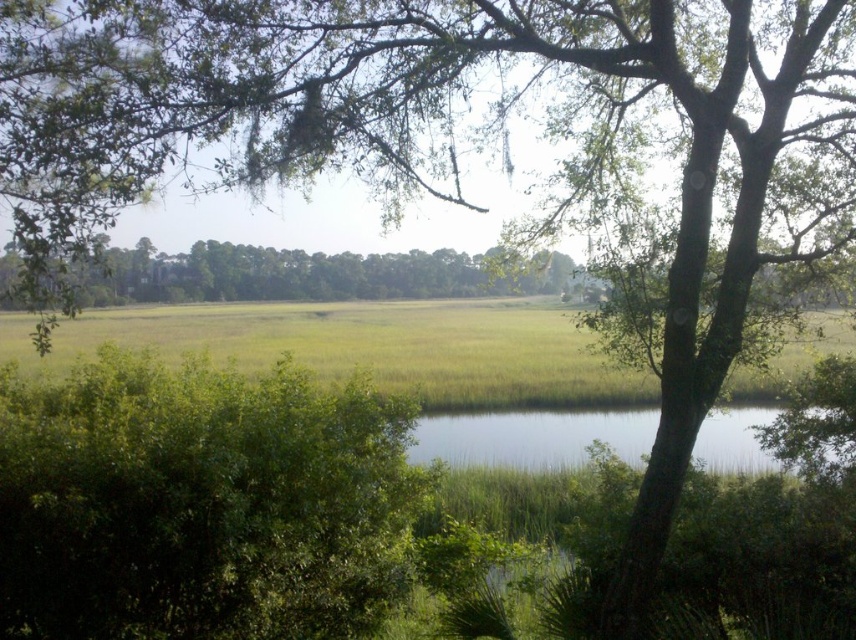
Which is more to the left, green leafy bush at center or green grassy field at center?

green leafy bush at center

Measure the distance from green leafy bush at center to green grassy field at center.

A distance of 9.19 meters exists between green leafy bush at center and green grassy field at center.

Where is `green leafy bush at center`? green leafy bush at center is located at coordinates (201, 502).

Does green leafy bush at center appear over green leafy tree at center?

No.

Which is above, green leafy bush at center or green leafy tree at center?

green leafy tree at center is above.

The height and width of the screenshot is (640, 856). Identify the location of green leafy bush at center. (201, 502).

Between green grassy field at center and clear water at center, which one is positioned lower?

clear water at center is lower down.

Does green grassy field at center have a lesser width compared to clear water at center?

In fact, green grassy field at center might be wider than clear water at center.

Is point (73, 356) positioned after point (762, 467)?

Yes.

Identify the location of green grassy field at center. (372, 346).